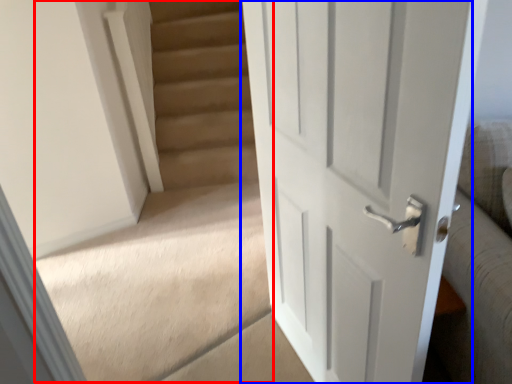
Question: Among these objects, which one is nearest to the camera, stairwell (highlighted by a red box) or door (highlighted by a blue box)?

Choices:
 (A) stairwell
 (B) door

Answer: (B)